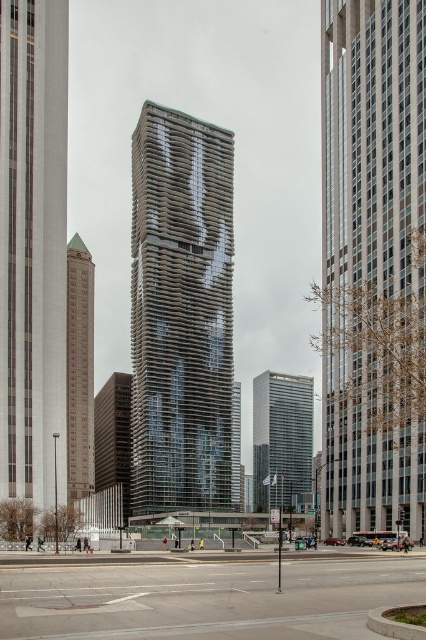
You are a city planner assessing the spacing between two prominent buildings in the scene. The glassy metallic tower at center and the glassy steel skyscraper at center are both central to the design. Given that the minimum required distance for safety between such structures is 200 feet, does the current spacing meet the safety regulations?

The distance between the glassy metallic tower at center and the glassy steel skyscraper at center is 265.11 feet, which exceeds the 200 feet safety requirement. Therefore, the spacing meets the safety regulations.

You are standing at point A which is at coordinates (x=32, y=248). You want to know what is located at that exact point. What is the object at point A?

The object at point A is the smooth white skyscraper at left.

Based on the photo, you are a city planner reviewing this urban design. You notice a point at coordinates (181, 312) in the scene. What does this point mark?

The point at coordinates (181, 312) marks the location of the glassy metallic tower at center.